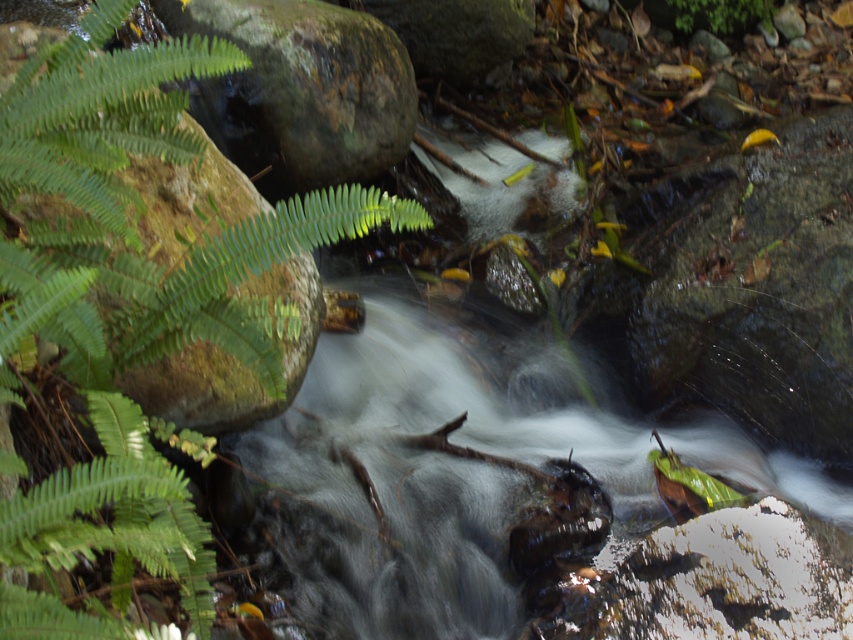
You are standing at the edge of the stream in the scene and want to reach a specific point. Which of the two points, point (51,150) or point (703,13), is closer to you?

Point (51,150) is closer to the viewer than point (703,13).